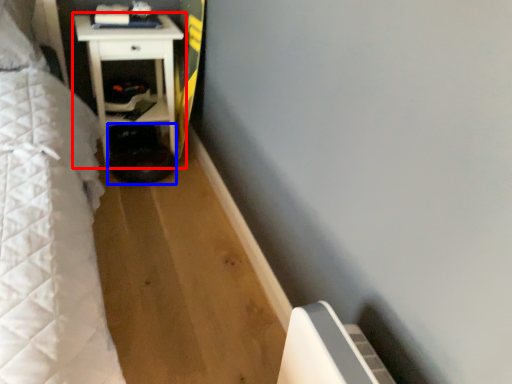
Question: Which object appears farthest to the camera in this image, furniture (highlighted by a red box) or step stool (highlighted by a blue box)?

Choices:
 (A) furniture
 (B) step stool

Answer: (B)